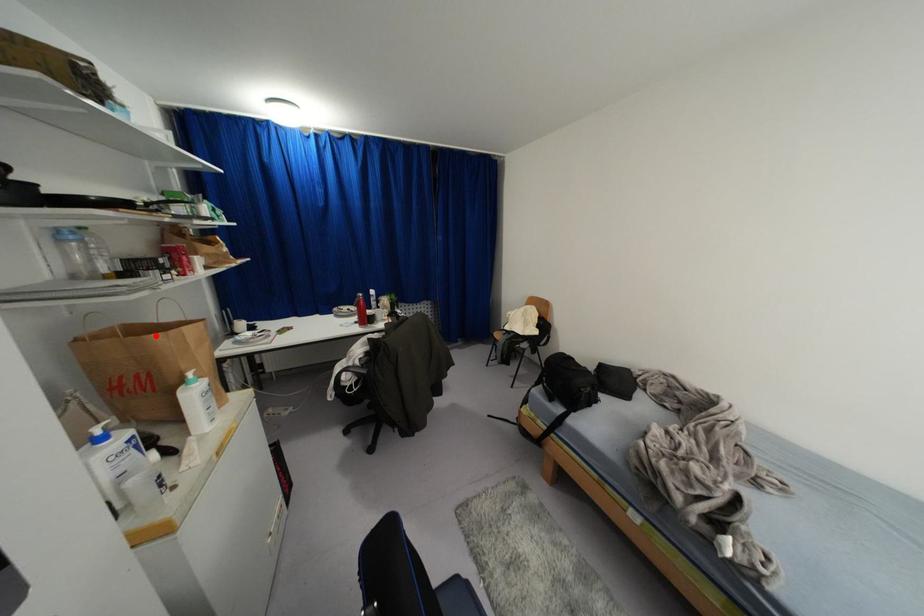
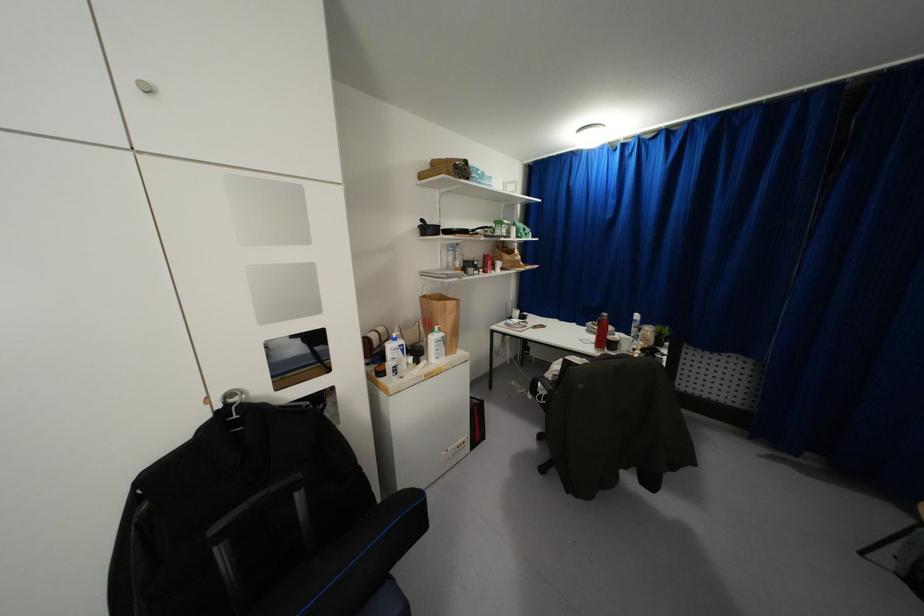
In the second image, find the point that corresponds to the highlighted location in the first image.

(434, 302)